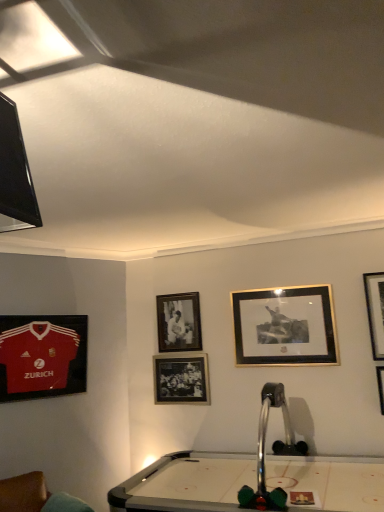
Question: Does matte jersey at left, the fifth picture frame viewed from the right, appear on the left side of metallic silver billiard table at center?

Choices:
 (A) yes
 (B) no

Answer: (A)

Question: Is the depth of matte jersey at left, positioned as the first picture frame in left-to-right order, greater than that of metallic silver billiard table at center?

Choices:
 (A) yes
 (B) no

Answer: (A)

Question: Is matte jersey at left, positioned as the first picture frame in left-to-right order, turned away from metallic silver billiard table at center?

Choices:
 (A) no
 (B) yes

Answer: (A)

Question: Is matte jersey at left, positioned as the first picture frame in left-to-right order, not inside metallic silver billiard table at center?

Choices:
 (A) no
 (B) yes

Answer: (B)

Question: Is matte jersey at left, the fifth picture frame viewed from the right, shorter than metallic silver billiard table at center?

Choices:
 (A) yes
 (B) no

Answer: (A)

Question: Considering the relative sizes of matte jersey at left, positioned as the first picture frame in left-to-right order, and metallic silver billiard table at center in the image provided, is matte jersey at left, positioned as the first picture frame in left-to-right order, smaller than metallic silver billiard table at center?

Choices:
 (A) yes
 (B) no

Answer: (A)

Question: Could you tell me if metallic silver billiard table at center is turned towards matte black picture frame at center, the third picture frame in the left-to-right sequence?

Choices:
 (A) no
 (B) yes

Answer: (A)

Question: Does metallic silver billiard table at center appear on the right side of matte black picture frame at center, which is the 3th picture frame from right to left?

Choices:
 (A) yes
 (B) no

Answer: (A)

Question: From a real-world perspective, is metallic silver billiard table at center physically above matte black picture frame at center, the third picture frame in the left-to-right sequence?

Choices:
 (A) no
 (B) yes

Answer: (A)

Question: Can you confirm if metallic silver billiard table at center is shorter than matte black picture frame at center, the third picture frame in the left-to-right sequence?

Choices:
 (A) yes
 (B) no

Answer: (B)

Question: From a real-world perspective, is metallic silver billiard table at center under matte black picture frame at center, the third picture frame in the left-to-right sequence?

Choices:
 (A) yes
 (B) no

Answer: (A)

Question: Is matte black picture frame at center, which is the 3th picture frame from right to left, surrounded by metallic silver billiard table at center?

Choices:
 (A) no
 (B) yes

Answer: (B)

Question: From a real-world perspective, is gold/black picture frame at upper center, the second picture frame viewed from the right, located beneath metallic silver billiard table at center?

Choices:
 (A) yes
 (B) no

Answer: (B)